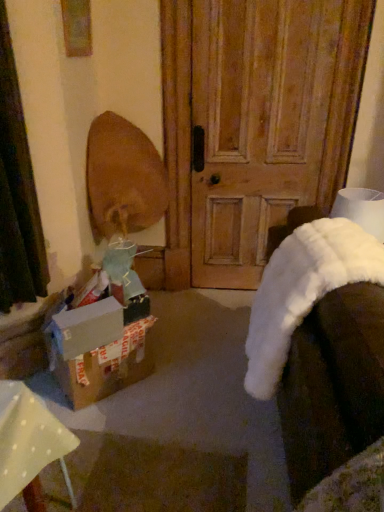
Question: From the image's perspective, is brown cardboard box at lower left positioned above or below white fluffy blanket at lower right?

Choices:
 (A) below
 (B) above

Answer: (A)

Question: Looking at their shapes, would you say brown cardboard box at lower left is wider or thinner than white fluffy blanket at lower right?

Choices:
 (A) wide
 (B) thin

Answer: (B)

Question: Which object is positioned closest to the cardboard box at lower left?

Choices:
 (A) white fluffy blanket at lower right
 (B) wooden door at center
 (C) brown cardboard box at lower left

Answer: (C)

Question: Estimate the real-world distances between objects in this image. Which object is farther from the wooden door at center?

Choices:
 (A) white fluffy blanket at lower right
 (B) brown cardboard box at lower left
 (C) cardboard box at lower left

Answer: (C)